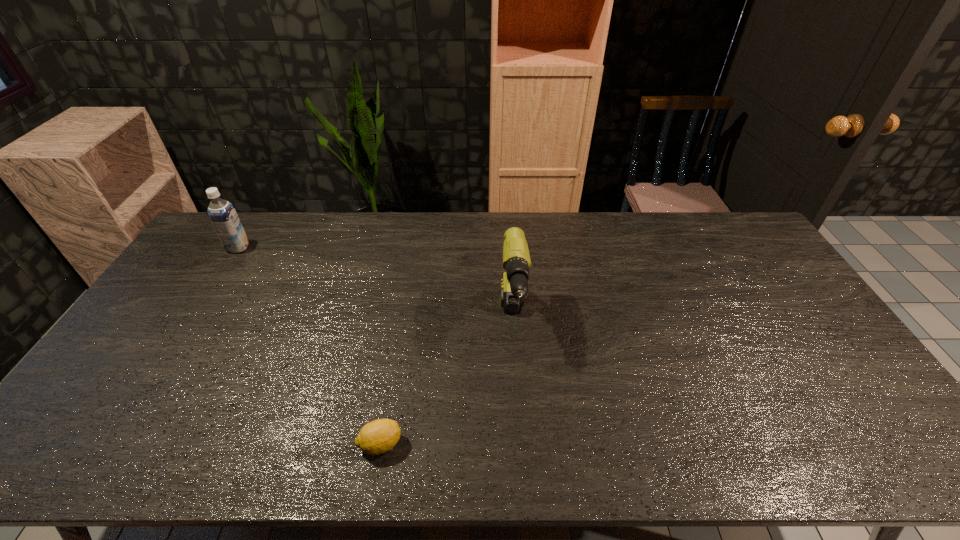
The height and width of the screenshot is (540, 960). Find the location of `object positioned at the near edge`. object positioned at the near edge is located at coordinates (381, 435).

Where is `object that is positioned at the left edge`? The height and width of the screenshot is (540, 960). object that is positioned at the left edge is located at coordinates (222, 214).

Where is `object that is at the far left corner`? Image resolution: width=960 pixels, height=540 pixels. object that is at the far left corner is located at coordinates (222, 214).

In the image, there is a desktop. Identify the location of vacant space at the far edge. The height and width of the screenshot is (540, 960). (540, 214).

Locate an element on the screen. Image resolution: width=960 pixels, height=540 pixels. blank space at the near edge of the desktop is located at coordinates (468, 461).

This screenshot has width=960, height=540. I want to click on free region at the left edge of the desktop, so click(x=174, y=346).

The image size is (960, 540). Find the location of `vacant space at the right edge of the desktop`. vacant space at the right edge of the desktop is located at coordinates (852, 397).

The image size is (960, 540). In order to click on blank space at the far right corner in this screenshot , I will do `click(719, 235)`.

In the image, there is a desktop. Where is `vacant space at the near right corner`? This screenshot has height=540, width=960. vacant space at the near right corner is located at coordinates (896, 456).

This screenshot has width=960, height=540. I want to click on unoccupied position between the leftmost object and the rightmost object, so click(x=375, y=284).